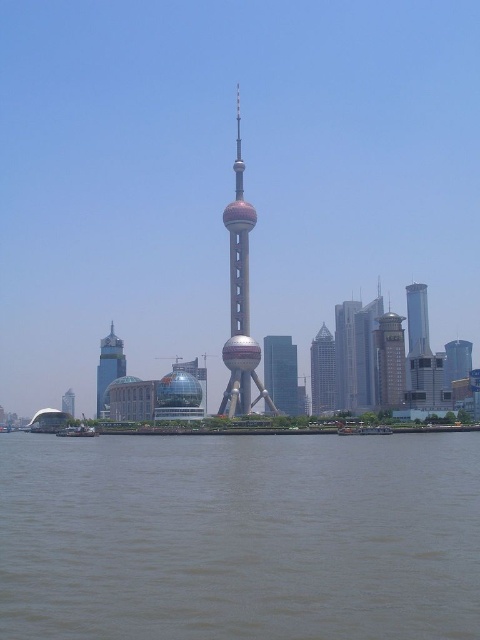
Does brick red brick building at center appear on the right side of smooth silver tower at right?

No, brick red brick building at center is not to the right of smooth silver tower at right.

Identify the location of brick red brick building at center. 389,362.

Does shiny silver skyscraper at lower left come behind glassy silver skyscraper at center right?

No, shiny silver skyscraper at lower left is closer to the viewer.

Is shiny silver skyscraper at lower left taller than glassy silver skyscraper at center right?

Correct, shiny silver skyscraper at lower left is much taller as glassy silver skyscraper at center right.

This screenshot has width=480, height=640. Identify the location of shiny silver skyscraper at lower left. (108, 369).

Which is in front, point (48, 595) or point (425, 316)?

Point (48, 595)

Which of these two, brown water at lower center or glassy silver skyscraper at center right, stands shorter?

glassy silver skyscraper at center right is shorter.

Which is in front, point (310, 532) or point (411, 314)?

Point (310, 532) is more forward.

Where is `brown water at lower center`? The width and height of the screenshot is (480, 640). brown water at lower center is located at coordinates (240, 538).